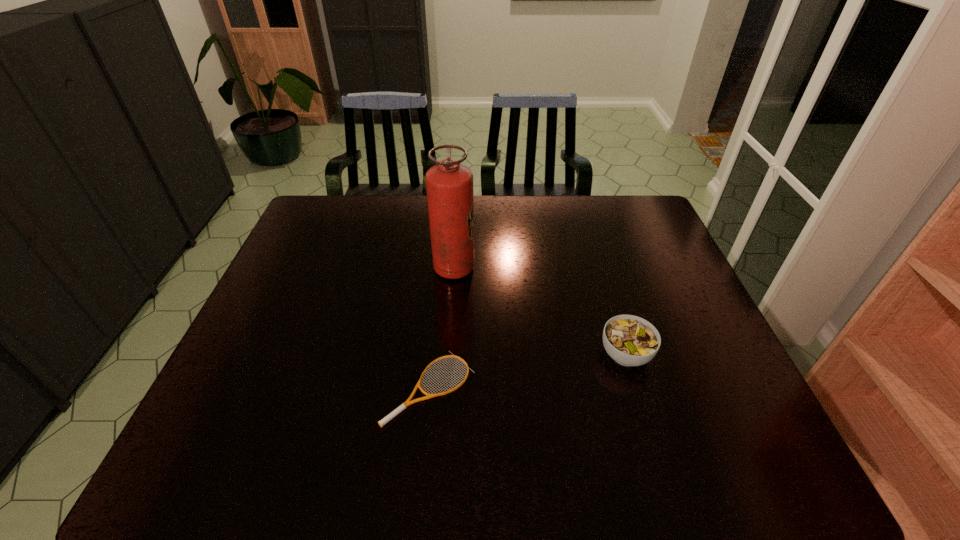
Find the location of a particular element. The image size is (960, 540). free spot between the rightmost object and the tennis racket is located at coordinates (528, 371).

You are a GUI agent. You are given a task and a screenshot of the screen. Output one action in this format:
    pyautogui.click(x=<x>, y=<y>)
    Task: Click on the free point between the soup bowl and the fire extinguisher
    This screenshot has height=540, width=960.
    Given the screenshot: What is the action you would take?
    pyautogui.click(x=540, y=312)

This screenshot has width=960, height=540. What are the coordinates of `free space between the tennis racket and the tallest object` in the screenshot? It's located at (442, 328).

Where is `free area in between the rightmost object and the fire extinguisher`? free area in between the rightmost object and the fire extinguisher is located at coordinates (540, 312).

The height and width of the screenshot is (540, 960). Identify the location of object that is the closest to the soup bowl. (408, 402).

Choose which object is the nearest neighbor to the tallest object. Please provide its 2D coordinates. Your answer should be formatted as a tuple, i.e. [(x, y)], where the tuple contains the x and y coordinates of a point satisfying the conditions above.

[(408, 402)]

Where is `vacant position in the image that satisfies the following two spatial constraints: 1. on the back side of the soup bowl; 2. on the label side of the fire extinguisher`? vacant position in the image that satisfies the following two spatial constraints: 1. on the back side of the soup bowl; 2. on the label side of the fire extinguisher is located at coordinates (599, 268).

Where is `vacant point that satisfies the following two spatial constraints: 1. on the label side of the farthest object; 2. on the front side of the tennis racket`? This screenshot has height=540, width=960. vacant point that satisfies the following two spatial constraints: 1. on the label side of the farthest object; 2. on the front side of the tennis racket is located at coordinates (445, 388).

This screenshot has height=540, width=960. What are the coordinates of `free space that satisfies the following two spatial constraints: 1. on the label side of the second tallest object; 2. on the right side of the fire extinguisher` in the screenshot? It's located at (448, 354).

You are a GUI agent. You are given a task and a screenshot of the screen. Output one action in this format:
    pyautogui.click(x=<x>, y=<y>)
    Task: Click on the free point that satisfies the following two spatial constraints: 1. on the back side of the soup bowl; 2. on the label side of the tallest object
    This screenshot has width=960, height=540.
    Given the screenshot: What is the action you would take?
    pyautogui.click(x=599, y=268)